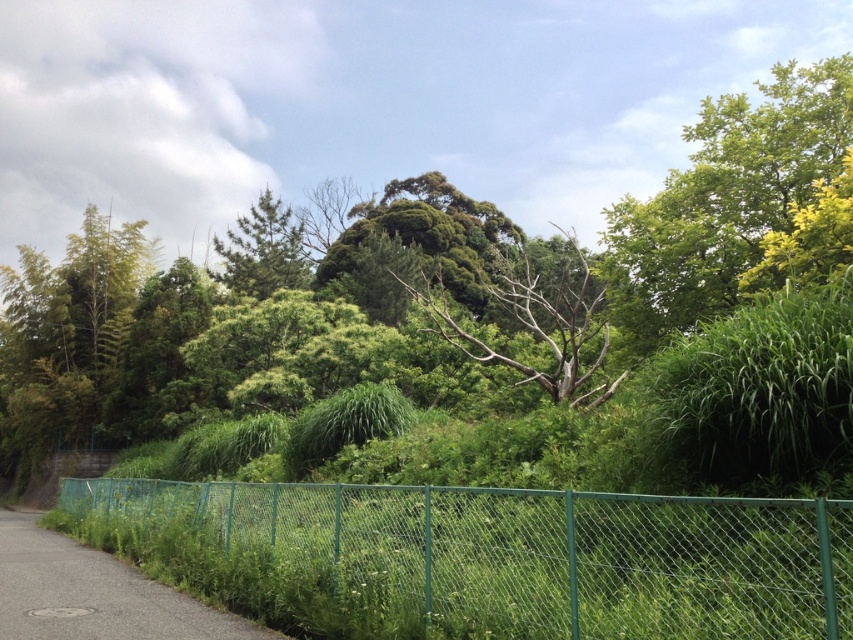
Can you confirm if green leafy tree at center is positioned below green matte tree at center?

Yes, green leafy tree at center is below green matte tree at center.

Consider the image. Does green leafy tree at center come behind green matte tree at center?

No, it is in front of green matte tree at center.

Is point (167, 365) closer to viewer compared to point (276, 275)?

Yes, it is in front of point (276, 275).

Identify the location of green leafy tree at center. (477, 328).

Who is taller, green leafy tree at center or bare wood tree at center?

Standing taller between the two is green leafy tree at center.

Which is behind, point (47, 397) or point (524, 282)?

The point (524, 282) is more distant.

Locate an element on the screen. Image resolution: width=853 pixels, height=640 pixels. green leafy tree at center is located at coordinates (477, 328).

Between green chain-link fence at lower left and asphalt road at lower left, which one appears on the right side from the viewer's perspective?

Positioned to the right is green chain-link fence at lower left.

Between green chain-link fence at lower left and asphalt road at lower left, which one has less height?

green chain-link fence at lower left

This screenshot has width=853, height=640. Describe the element at coordinates (529, 552) in the screenshot. I see `green chain-link fence at lower left` at that location.

Locate an element on the screen. green chain-link fence at lower left is located at coordinates (529, 552).